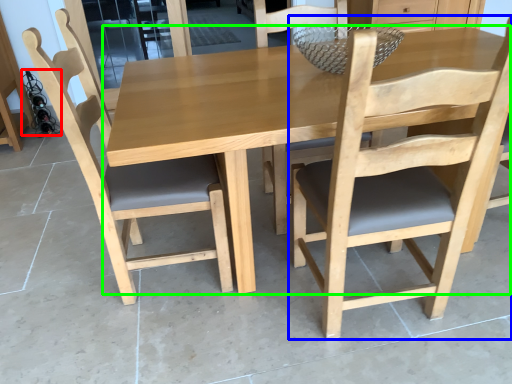
Question: Which is nearer to the wine bottle (highlighted by a red box)? chair (highlighted by a blue box) or kitchen & dining room table (highlighted by a green box).

Choices:
 (A) chair
 (B) kitchen & dining room table

Answer: (B)